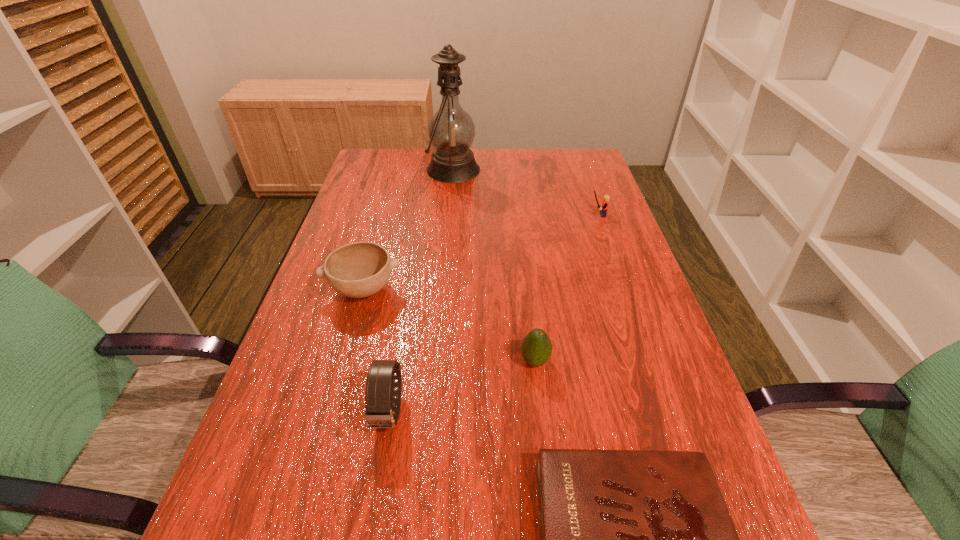
Where is `empty space between the oil lamp and the third farthest object`? Image resolution: width=960 pixels, height=540 pixels. empty space between the oil lamp and the third farthest object is located at coordinates (408, 230).

Identify the location of blank region between the fourth farthest object and the second nearest object. (462, 387).

Find the location of a particular element. empty space between the second farthest object and the avocado is located at coordinates (566, 288).

Find the location of `free space between the Lego and the avocado`. free space between the Lego and the avocado is located at coordinates (566, 288).

Image resolution: width=960 pixels, height=540 pixels. I want to click on free space that is in between the avocado and the watch, so click(x=462, y=387).

Locate an element on the screen. object that ranks as the fourth closest to the fourth nearest object is located at coordinates (631, 539).

Find the location of a particular element. the fifth closest object to the second nearest object is located at coordinates pos(451,130).

You are a GUI agent. You are given a task and a screenshot of the screen. Output one action in this format:
    pyautogui.click(x=<x>, y=<y>)
    Task: Click on the free space that satisfies the following two spatial constraints: 1. on the front-facing side of the Lego; 2. on the face of the watch
    
    Given the screenshot: What is the action you would take?
    pyautogui.click(x=665, y=411)

Locate an element on the screen. vacant space that satisfies the following two spatial constraints: 1. on the front-facing side of the Lego; 2. on the face of the watch is located at coordinates (665, 411).